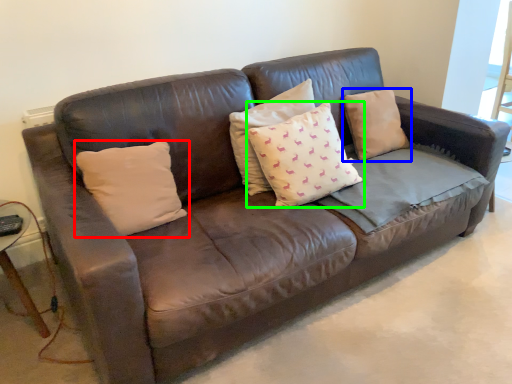
Question: Estimate the real-world distances between objects in this image. Which object is closer to pillow (highlighted by a red box), pillow (highlighted by a blue box) or pillow (highlighted by a green box)?

Choices:
 (A) pillow
 (B) pillow

Answer: (B)